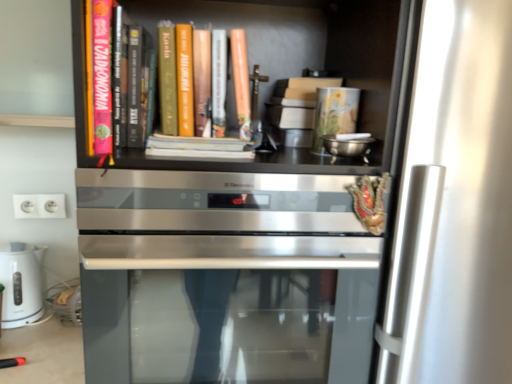
Question: Is pink matte book at upper left, which appears as the 2th book when viewed from the right, smaller than satin silver oven at center?

Choices:
 (A) no
 (B) yes

Answer: (B)

Question: From a real-world perspective, is pink matte book at upper left, the 1th book viewed from the left, located beneath satin silver oven at center?

Choices:
 (A) yes
 (B) no

Answer: (B)

Question: Can you see pink matte book at upper left, which appears as the 2th book when viewed from the right, touching satin silver oven at center?

Choices:
 (A) no
 (B) yes

Answer: (A)

Question: Is pink matte book at upper left, the 1th book viewed from the left, closer to the viewer compared to satin silver oven at center?

Choices:
 (A) yes
 (B) no

Answer: (B)

Question: Considering the relative sizes of pink matte book at upper left, which appears as the 2th book when viewed from the right, and satin silver oven at center in the image provided, is pink matte book at upper left, which appears as the 2th book when viewed from the right, wider than satin silver oven at center?

Choices:
 (A) yes
 (B) no

Answer: (B)

Question: Can you confirm if pink matte book at upper left, the 1th book viewed from the left, is positioned to the left of satin silver oven at center?

Choices:
 (A) no
 (B) yes

Answer: (B)

Question: Is white plastic electrical outlet at lower left facing away from matte orange book at center, the 1th book from the right?

Choices:
 (A) yes
 (B) no

Answer: (B)

Question: Considering the relative positions of white plastic electrical outlet at lower left and matte orange book at center, the 1th book from the right, in the image provided, is white plastic electrical outlet at lower left to the left of matte orange book at center, the 1th book from the right, from the viewer's perspective?

Choices:
 (A) no
 (B) yes

Answer: (B)

Question: From the image's perspective, does white plastic electrical outlet at lower left appear lower than matte orange book at center, positioned as the second book in left-to-right order?

Choices:
 (A) no
 (B) yes

Answer: (B)

Question: Considering the relative sizes of white plastic electrical outlet at lower left and matte orange book at center, positioned as the second book in left-to-right order, in the image provided, is white plastic electrical outlet at lower left thinner than matte orange book at center, positioned as the second book in left-to-right order,?

Choices:
 (A) yes
 (B) no

Answer: (A)

Question: From a real-world perspective, is white plastic electrical outlet at lower left physically above matte orange book at center, the 1th book from the right?

Choices:
 (A) yes
 (B) no

Answer: (B)

Question: Is white plastic electrical outlet at lower left directly adjacent to matte orange book at center, the 1th book from the right?

Choices:
 (A) no
 (B) yes

Answer: (A)

Question: Is matte orange book at center, the 1th book from the right, thinner than satin silver oven at center?

Choices:
 (A) yes
 (B) no

Answer: (A)